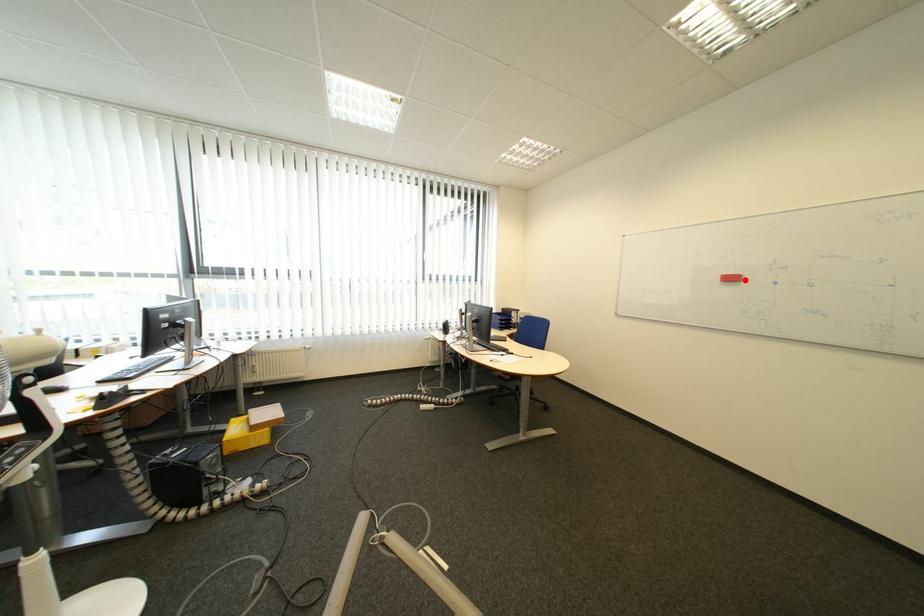
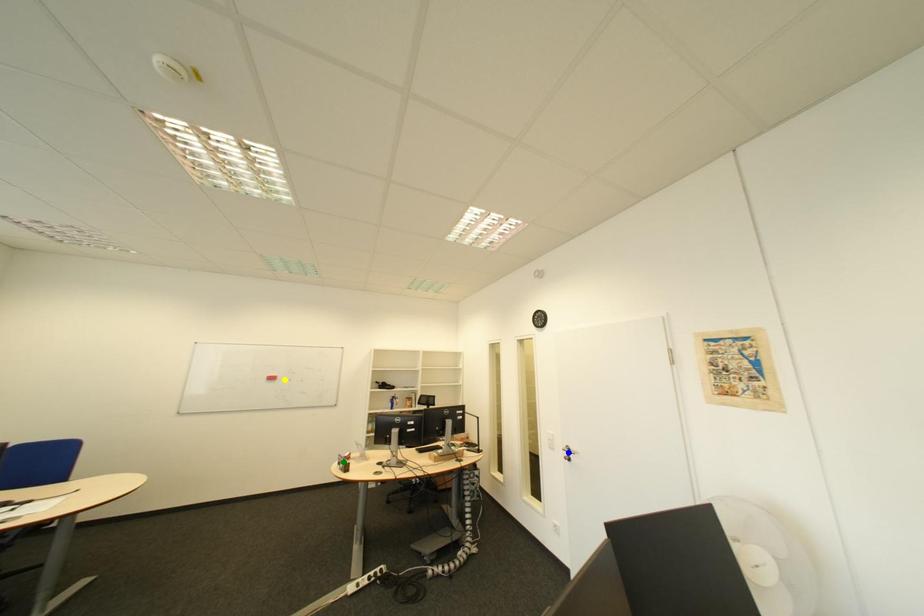
Question: I am providing you with two images of the same scene from different viewpoints. A red point is marked on the first image. You are given multiple points on the second image. Which mark in image 2 goes with the point in image 1?

Choices:
 (A) green point
 (B) yellow point
 (C) blue point

Answer: (B)